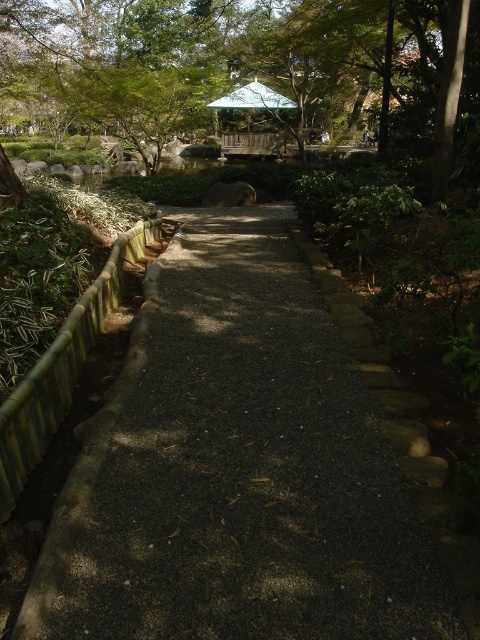
Question: Can you confirm if green leafy tree at upper left is positioned to the right of green wooden gazebo at upper center?

Choices:
 (A) no
 (B) yes

Answer: (A)

Question: Which object is closer to the camera taking this photo?

Choices:
 (A) green wooden gazebo at upper center
 (B) dark gravel path at center
 (C) green leafy tree at upper left

Answer: (B)

Question: Which point is farther from the camera taking this photo?

Choices:
 (A) (359, 305)
 (B) (363, 65)

Answer: (B)

Question: Can you confirm if dark gravel path at center is positioned below green leafy tree at upper left?

Choices:
 (A) yes
 (B) no

Answer: (A)

Question: Which point is closer to the camera?

Choices:
 (A) (211, 276)
 (B) (268, 136)

Answer: (A)

Question: Is green leafy tree at upper left below green wooden gazebo at upper center?

Choices:
 (A) yes
 (B) no

Answer: (B)